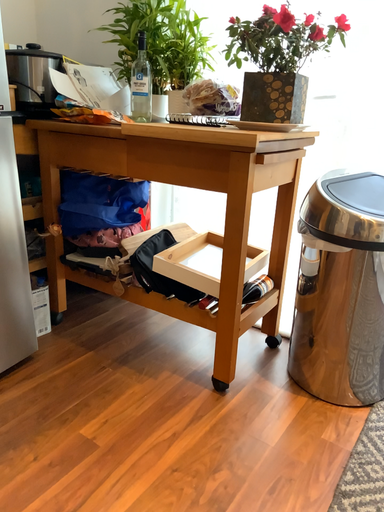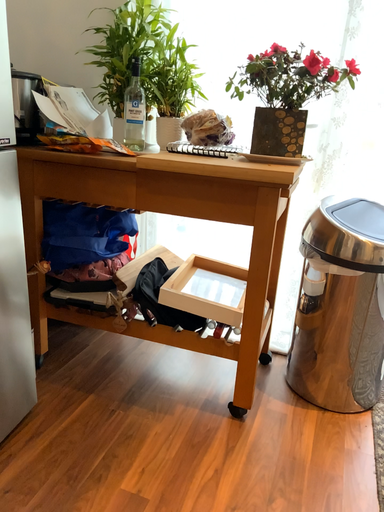
Question: How did the camera likely rotate when shooting the video?

Choices:
 (A) rotated right
 (B) rotated left

Answer: (A)